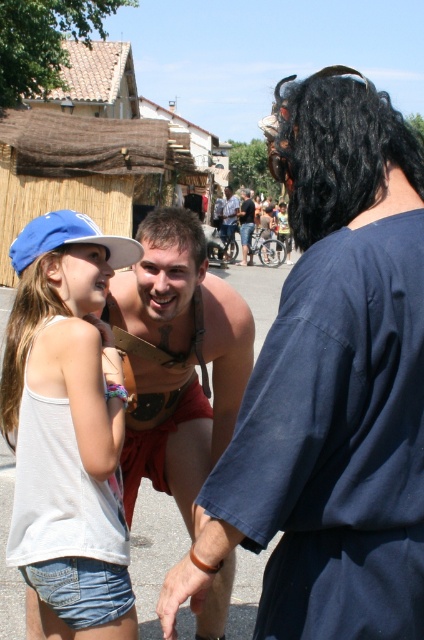
Question: Among these objects, which one is farthest from the camera?

Choices:
 (A) blue fabric baseball cap at upper left
 (B) white denim shorts at lower left

Answer: (A)

Question: Does white denim shorts at lower left appear over shiny black shirt at center?

Choices:
 (A) yes
 (B) no

Answer: (B)

Question: Which object is positioned farthest from the shiny gold armor at center?

Choices:
 (A) shiny black shirt at center
 (B) shiny metallic belt at lower left
 (C) blue fabric baseball cap at upper left
 (D) white denim shorts at lower left

Answer: (B)

Question: Is shiny leather belt at center wider than white denim shorts at lower left?

Choices:
 (A) no
 (B) yes

Answer: (B)

Question: Is shiny metallic belt at lower left positioned in front of shiny leather belt at center?

Choices:
 (A) no
 (B) yes

Answer: (B)

Question: Which of the following is the farthest from the observer?

Choices:
 (A) (72, 544)
 (B) (399, 401)
 (C) (228, 195)
 (D) (245, 230)

Answer: (C)